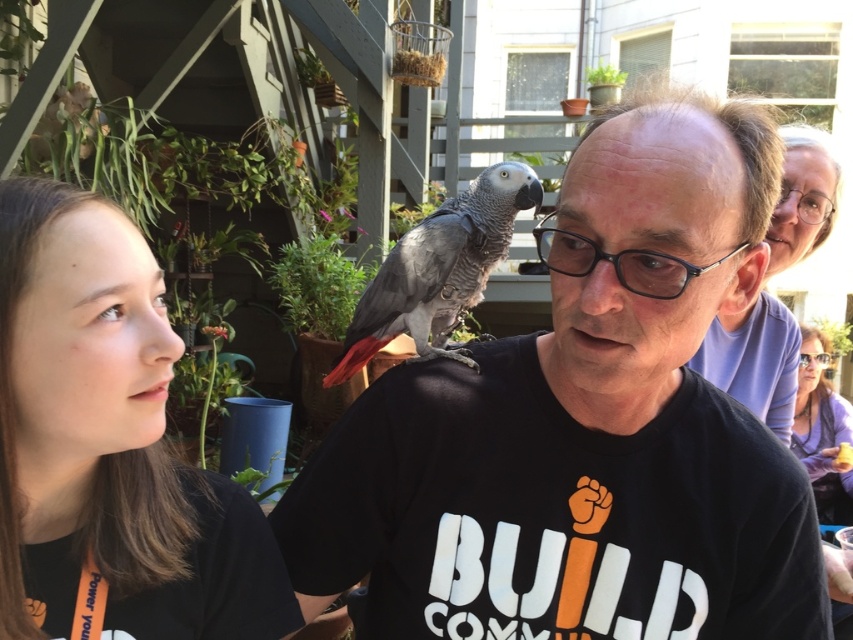
You are an interior designer assessing the color balance in this outdoor space. Given the brown matte hair at upper left and the purple fabric at upper right, which object would you consider to have a more prominent visual presence due to its size?

The purple fabric at upper right has a more prominent visual presence because it is larger in size compared to the brown matte hair at upper left.